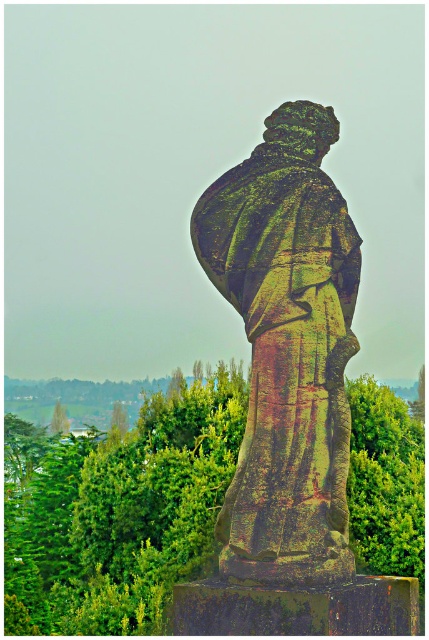
Can you confirm if green leafy tree at center is thinner than rusty stone statue at center?

Incorrect, green leafy tree at center's width is not less than rusty stone statue at center's.

Does green leafy tree at center appear over rusty stone statue at center?

Incorrect, green leafy tree at center is not positioned above rusty stone statue at center.

Describe the element at coordinates (118, 513) in the screenshot. The width and height of the screenshot is (429, 640). I see `green leafy tree at center` at that location.

This screenshot has width=429, height=640. I want to click on green leafy tree at center, so click(118, 513).